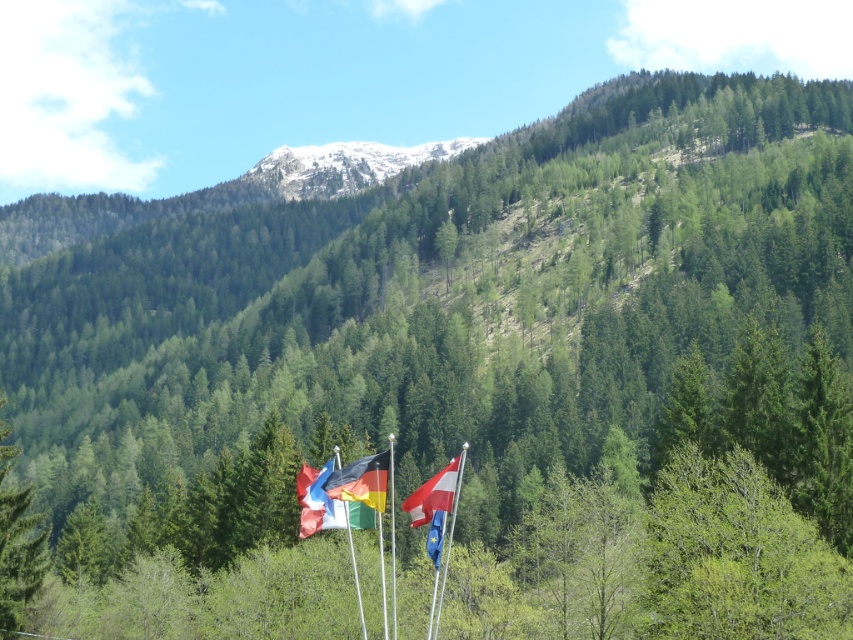
You are standing in a scenic area with a lush green forested hillside and several flagpoles with national flags like the German flag. There is a point marked at coordinates (x=344, y=164). What does this point most likely represent in the scene?

The point at coordinates (x=344, y=164) most likely represents the white snow covered mountain at upper center as stated in the objects description.

You are a photographer standing at the base of the forested hillside. You want to take a photo of the white fabric flag at center and ensure it is in focus while also capturing the snowcapped mountain peak in the background. What should you do to achieve this?

To capture both the white fabric flag at center and the snowcapped mountain peak in focus, you should use a small aperture setting on your camera to increase the depth of field, ensuring both foreground and background elements are sharp.